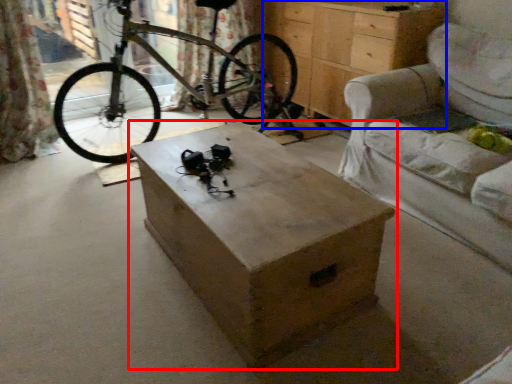
Question: Which object is further to the camera taking this photo, table (highlighted by a red box) or chest of drawers (highlighted by a blue box)?

Choices:
 (A) table
 (B) chest of drawers

Answer: (B)